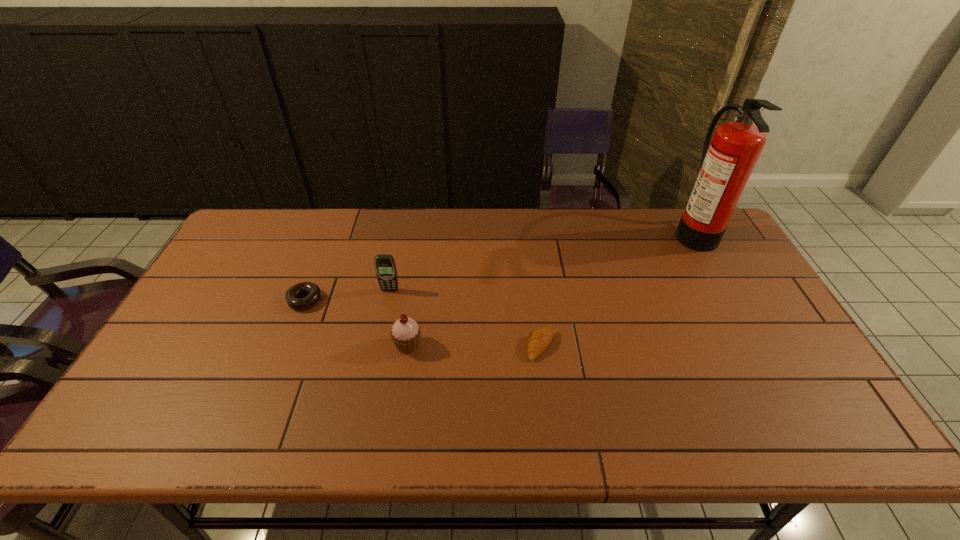
Image resolution: width=960 pixels, height=540 pixels. In order to click on fire extinguisher in this screenshot , I will do `click(727, 162)`.

At what (x,y) coordinates should I click in order to perform the action: click on the tallest object. Please return your answer as a coordinate pair (x, y). The height and width of the screenshot is (540, 960). Looking at the image, I should click on (727, 162).

This screenshot has height=540, width=960. I want to click on cellular telephone, so click(385, 266).

Identify the location of cupcake. (405, 333).

Where is `the third object from left to right`? Image resolution: width=960 pixels, height=540 pixels. the third object from left to right is located at coordinates (405, 333).

Locate an element on the screen. The image size is (960, 540). the second object from right to left is located at coordinates (540, 339).

The height and width of the screenshot is (540, 960). Identify the location of the leftmost object. (313, 291).

You are a GUI agent. You are given a task and a screenshot of the screen. Output one action in this format:
    pyautogui.click(x=<x>, y=<y>)
    Task: Click on the vacant space located 0.270m on the front-facing side of the rightmost object
    
    Given the screenshot: What is the action you would take?
    pyautogui.click(x=594, y=232)

You are a GUI agent. You are given a task and a screenshot of the screen. Output one action in this format:
    pyautogui.click(x=<x>, y=<y>)
    Task: Click on the vacant space located 0.330m on the front-facing side of the rightmost object
    This screenshot has width=960, height=540.
    Given the screenshot: What is the action you would take?
    pyautogui.click(x=577, y=232)

Where is `free space located 0.120m on the front-facing side of the rightmost object`? The width and height of the screenshot is (960, 540). free space located 0.120m on the front-facing side of the rightmost object is located at coordinates (638, 232).